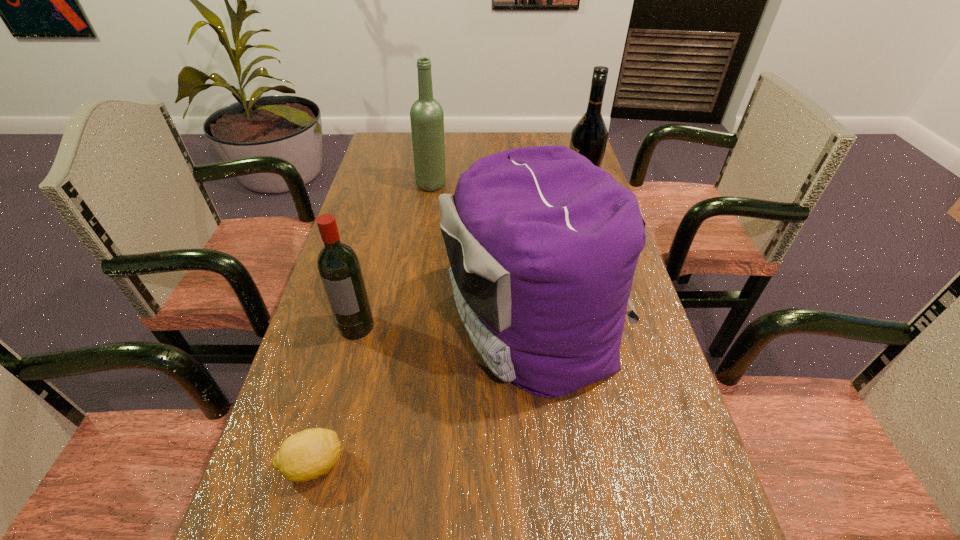
What are the coordinates of `free spot located 0.230m on the front pocket of the backpack` in the screenshot? It's located at [343, 322].

At what (x,y) coordinates should I click in order to perform the action: click on vacant space positioned on the label of the rightmost wine bottle. Please return your answer as a coordinate pair (x, y). The height and width of the screenshot is (540, 960). Looking at the image, I should click on (484, 189).

Identify the location of vacant region located on the label of the rightmost wine bottle. Image resolution: width=960 pixels, height=540 pixels. (488, 189).

The image size is (960, 540). Identify the location of free space located 0.090m on the label of the rightmost wine bottle. (535, 189).

Where is `free space located 0.140m on the label of the nearest wine bottle`? Image resolution: width=960 pixels, height=540 pixels. free space located 0.140m on the label of the nearest wine bottle is located at coordinates (338, 397).

The image size is (960, 540). Find the location of `vacant space situated 0.400m at the stem end of the lemon`. vacant space situated 0.400m at the stem end of the lemon is located at coordinates (575, 464).

Identify the location of wine bottle that is positioned at the left edge. point(339,268).

At what (x,y) coordinates should I click in order to perform the action: click on lemon at the left edge. Please return your answer as a coordinate pair (x, y). Image resolution: width=960 pixels, height=540 pixels. Looking at the image, I should click on (308, 454).

At what (x,y) coordinates should I click in order to perform the action: click on backpack positioned at the right edge. Please return your answer as a coordinate pair (x, y). Looking at the image, I should click on (543, 245).

Locate an element on the screen. This screenshot has width=960, height=540. wine bottle positioned at the right edge is located at coordinates (589, 137).